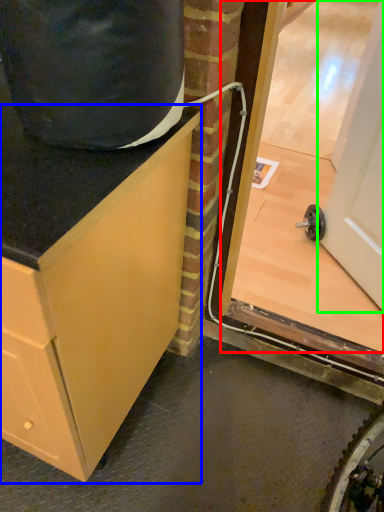
Question: Based on their relative distances, which object is farther from glass door (highlighted by a red box)? Choose from cabinetry (highlighted by a blue box) and door (highlighted by a green box).

Choices:
 (A) cabinetry
 (B) door

Answer: (A)